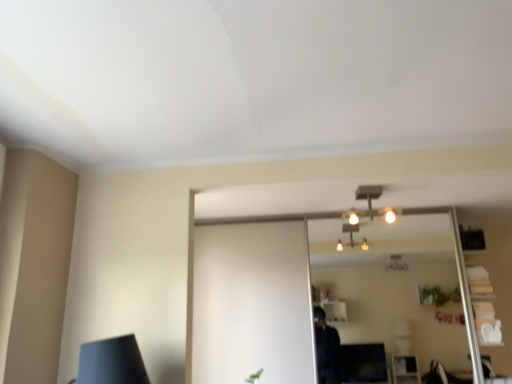
Question: From a real-world perspective, is clear glass mirror at center physically located above or below matte silver light fixture at center?

Choices:
 (A) above
 (B) below

Answer: (B)

Question: Looking at the image, does clear glass mirror at center seem bigger or smaller compared to matte silver light fixture at center?

Choices:
 (A) small
 (B) big

Answer: (B)

Question: In the image, is clear glass mirror at center positioned in front of or behind matte silver light fixture at center?

Choices:
 (A) behind
 (B) front

Answer: (A)

Question: Based on their sizes in the image, would you say matte silver light fixture at center is bigger or smaller than clear glass mirror at center?

Choices:
 (A) small
 (B) big

Answer: (A)

Question: From a real-world perspective, relative to clear glass mirror at center, is matte silver light fixture at center vertically above or below?

Choices:
 (A) below
 (B) above

Answer: (B)

Question: Is matte silver light fixture at center in front of or behind clear glass mirror at center in the image?

Choices:
 (A) behind
 (B) front

Answer: (B)

Question: Visually, is matte silver light fixture at center positioned to the left or to the right of clear glass mirror at center?

Choices:
 (A) left
 (B) right

Answer: (A)